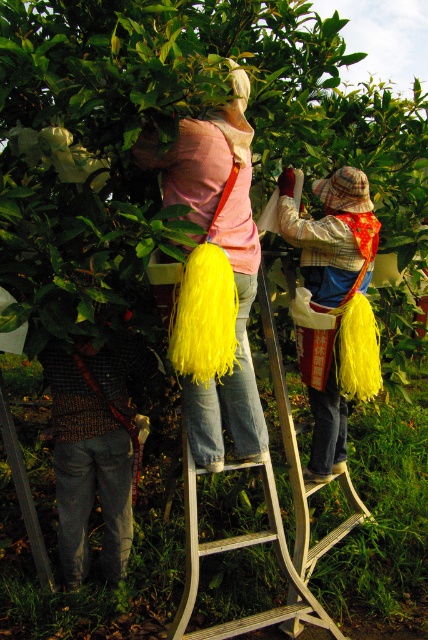
You are a farmer in the orchard and need to choose between the pink fabric bag at center and the yellow fabric bag at center to carry more fruits. Which bag should you choose?

The pink fabric bag at center is bigger than the yellow fabric bag at center, so you should choose the pink fabric bag at center to carry more fruits.

You are a farmer who needs to choose between the pink fabric bag at center and the yellow fabric bag at center to carry harvested fruits. Which bag has a larger capacity based on their widths?

The pink fabric bag at center has a larger width than the yellow fabric bag at center, so it likely has a greater capacity for carrying fruits.